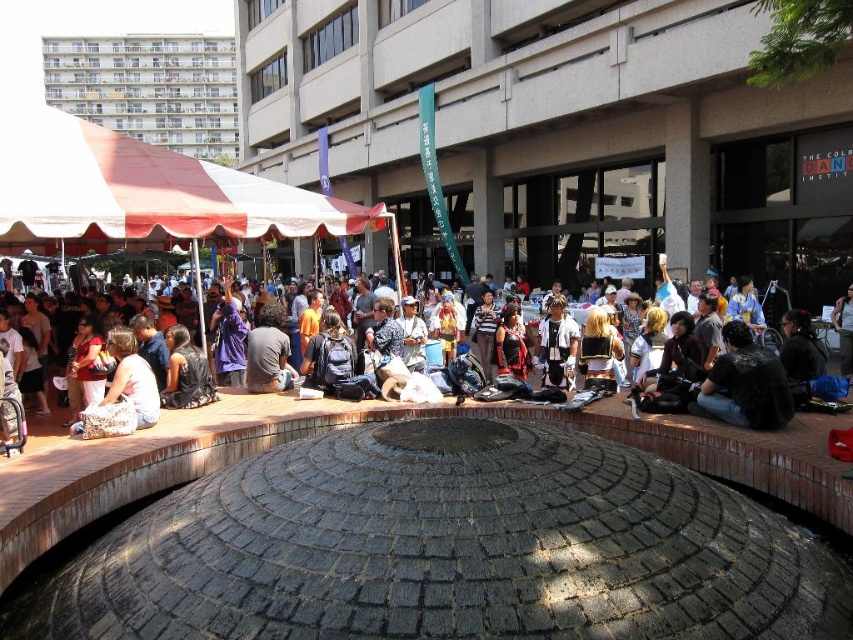
Who is higher up, dark gray backpack at center or white fabric bag at center?

Positioned higher is dark gray backpack at center.

Is dark gray backpack at center shorter than white fabric bag at center?

No.

This screenshot has height=640, width=853. I want to click on dark gray backpack at center, so click(x=268, y=353).

Locate an element on the screen. dark gray backpack at center is located at coordinates (268, 353).

Between white matte jacket at center and matte black backpack at center, which one is positioned higher?

matte black backpack at center is above.

Does point (555, 310) come farther from viewer compared to point (30, 429)?

Yes, point (555, 310) is farther from viewer.

This screenshot has height=640, width=853. Find the location of `white matte jacket at center`. white matte jacket at center is located at coordinates (556, 344).

Does dark gray leather jacket at center appear over white matte jacket at center?

No.

Can you confirm if dark gray leather jacket at center is wider than white matte jacket at center?

Indeed, dark gray leather jacket at center has a greater width compared to white matte jacket at center.

The width and height of the screenshot is (853, 640). I want to click on dark gray leather jacket at center, so click(746, 385).